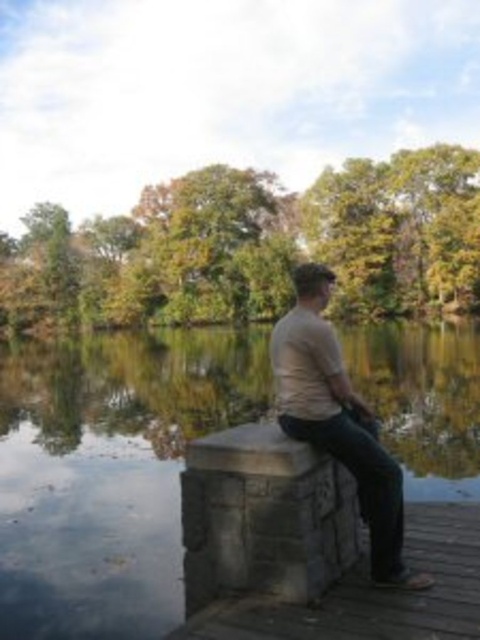
Is smooth stone lake at center shorter than beige cotton shirt at center?

No, smooth stone lake at center is not shorter than beige cotton shirt at center.

Can you confirm if smooth stone lake at center is smaller than beige cotton shirt at center?

No, smooth stone lake at center is not smaller than beige cotton shirt at center.

The width and height of the screenshot is (480, 640). I want to click on smooth stone lake at center, so click(108, 472).